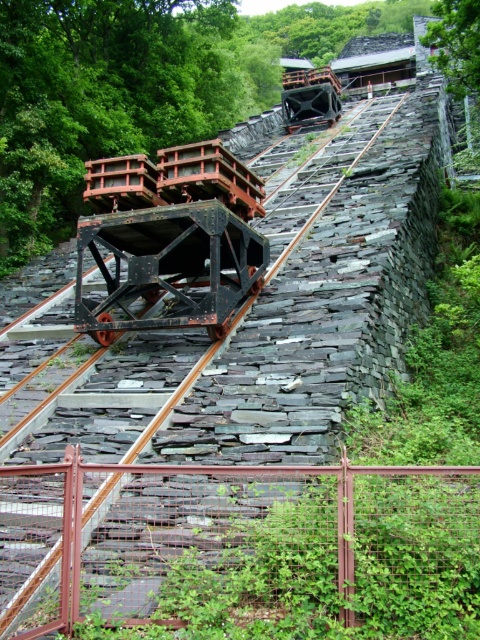
Is rusty metal rail at center bigger than rusty metal train track at center?

No, rusty metal rail at center is not bigger than rusty metal train track at center.

Is point (410, 508) in front of point (141, 515)?

Yes, it is.

Image resolution: width=480 pixels, height=640 pixels. I want to click on rusty metal rail at center, so click(x=240, y=545).